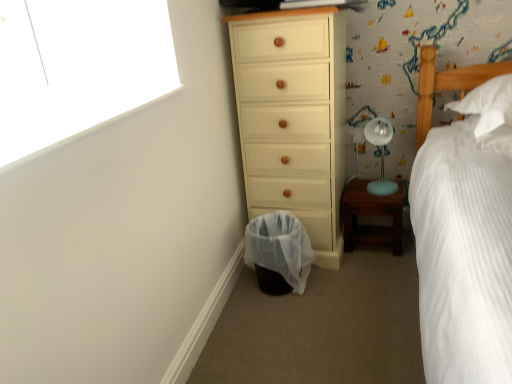
This screenshot has width=512, height=384. What are the coordinates of `free space that is in between matte cream chest of drawers at center and wooden nightstand at lower right` in the screenshot? It's located at (364, 258).